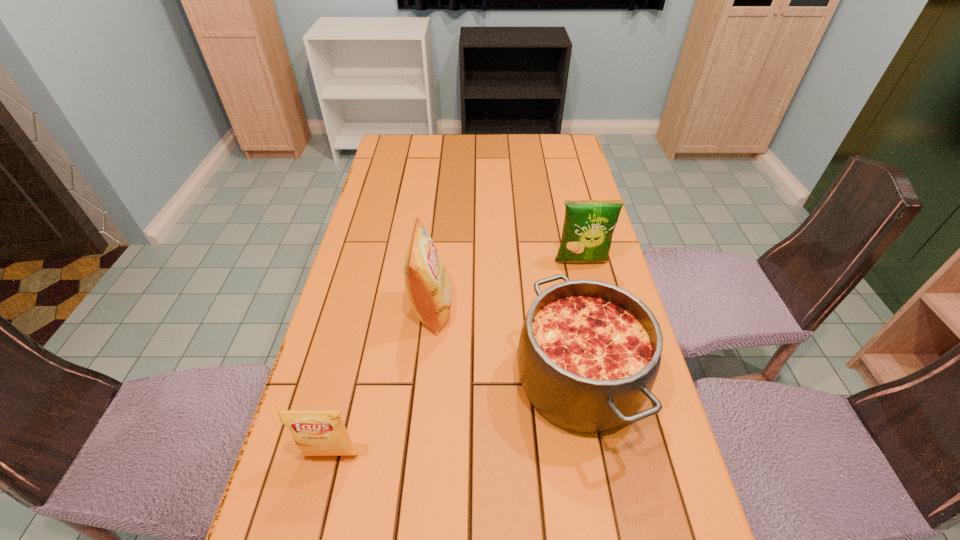
The image size is (960, 540). In order to click on free spot located on the front of the leftmost object with the logo in this screenshot , I will do `click(318, 514)`.

What are the coordinates of `object that is at the left edge` in the screenshot? It's located at (316, 432).

Locate an element on the screen. The height and width of the screenshot is (540, 960). crisp (potato chip) present at the right edge is located at coordinates (588, 227).

Find the location of a particular element. Image resolution: width=960 pixels, height=540 pixels. casserole that is at the right edge is located at coordinates (589, 352).

The width and height of the screenshot is (960, 540). In the image, there is a desktop. What are the coordinates of `free region at the far edge` in the screenshot? It's located at (474, 144).

Where is `vacant space at the left edge`? This screenshot has height=540, width=960. vacant space at the left edge is located at coordinates (363, 474).

The image size is (960, 540). What are the coordinates of `vacant area at the far left corner of the desktop` in the screenshot? It's located at (402, 138).

Find the location of a particular element. The image size is (960, 540). empty space that is in between the second object from left to right and the casserole is located at coordinates (505, 345).

The width and height of the screenshot is (960, 540). In order to click on vacant space in between the second crisp (potato chip) from right to left and the rightmost crisp (potato chip) in this screenshot , I will do `click(507, 286)`.

Find the location of a particular element. free space between the casserole and the leftmost crisp (potato chip) is located at coordinates pos(455,418).